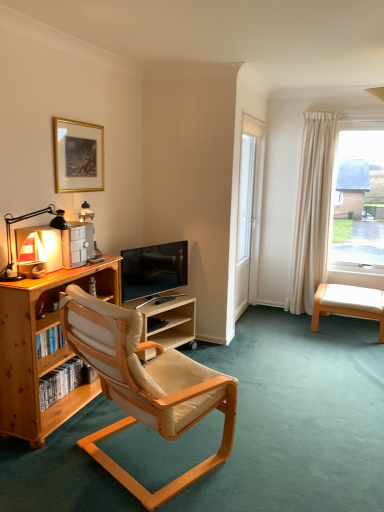
Question: From a real-world perspective, does beige leather swivel chair at lower right sit lower than white glass screen door at center?

Choices:
 (A) no
 (B) yes

Answer: (B)

Question: Is beige leather swivel chair at lower right closer to the viewer compared to white glass screen door at center?

Choices:
 (A) yes
 (B) no

Answer: (B)

Question: Would you say beige leather swivel chair at lower right is outside white glass screen door at center?

Choices:
 (A) no
 (B) yes

Answer: (B)

Question: Can you confirm if beige leather swivel chair at lower right is taller than white glass screen door at center?

Choices:
 (A) no
 (B) yes

Answer: (A)

Question: Is white glass screen door at center located within beige leather swivel chair at lower right?

Choices:
 (A) no
 (B) yes

Answer: (A)

Question: Is beige leather swivel chair at lower right placed right next to white glass screen door at center?

Choices:
 (A) no
 (B) yes

Answer: (A)

Question: From the image's perspective, is wooden bookcase at left on top of beige leather swivel chair at lower right?

Choices:
 (A) yes
 (B) no

Answer: (A)

Question: Can you confirm if wooden bookcase at left is wider than beige leather swivel chair at lower right?

Choices:
 (A) yes
 (B) no

Answer: (B)

Question: Does wooden bookcase at left come behind beige leather swivel chair at lower right?

Choices:
 (A) yes
 (B) no

Answer: (B)

Question: Is wooden bookcase at left not within beige leather swivel chair at lower right?

Choices:
 (A) no
 (B) yes

Answer: (B)

Question: Does wooden bookcase at left have a smaller size compared to beige leather swivel chair at lower right?

Choices:
 (A) yes
 (B) no

Answer: (B)

Question: Is wooden bookcase at left facing towards beige leather swivel chair at lower right?

Choices:
 (A) no
 (B) yes

Answer: (A)

Question: Can you see matte black desk lamp at left touching beige leather swivel chair at lower right?

Choices:
 (A) no
 (B) yes

Answer: (A)